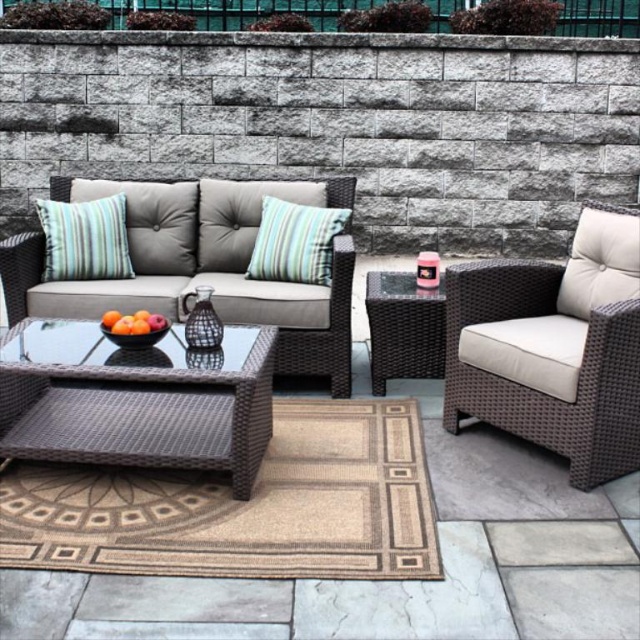
Question: Does matte wicker side table at center appear over striped fabric pillow at center?

Choices:
 (A) no
 (B) yes

Answer: (A)

Question: Can you confirm if woven rattan couch at center is positioned to the left of striped fabric pillow at upper left?

Choices:
 (A) no
 (B) yes

Answer: (A)

Question: Is brown woven armchair at right below striped fabric pillow at center?

Choices:
 (A) yes
 (B) no

Answer: (A)

Question: Based on their relative distances, which object is farther from the matte wicker side table at center?

Choices:
 (A) striped fabric pillow at upper left
 (B) glossy wicker table at center
 (C) striped fabric pillow at center

Answer: (A)

Question: Which of the following is the closest to the observer?

Choices:
 (A) glossy wicker table at center
 (B) woven rattan couch at center
 (C) striped fabric pillow at center
 (D) matte wicker side table at center

Answer: (A)

Question: Estimate the real-world distances between objects in this image. Which object is farther from the woven rattan couch at center?

Choices:
 (A) matte wicker side table at center
 (B) glossy wicker table at center
 (C) striped fabric pillow at upper left

Answer: (B)